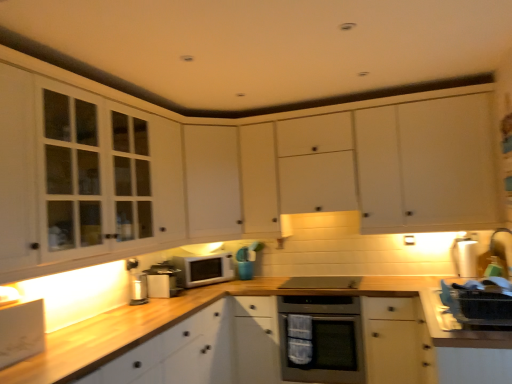
Question: From the image's perspective, would you say white wood cabinet at lower left, which appears as the 5th cabinetry when viewed from the top, is positioned over white glass-fronted cabinets at left, arranged as the 3th cabinetry when ordered from the bottom?

Choices:
 (A) no
 (B) yes

Answer: (A)

Question: Is white wood cabinet at lower left, positioned as the first cabinetry in bottom-to-top order, wider than white glass-fronted cabinets at left, arranged as the 3th cabinetry when ordered from the bottom?

Choices:
 (A) no
 (B) yes

Answer: (B)

Question: Is white glass-fronted cabinets at left, which is the third cabinetry from top to bottom, at the back of white wood cabinet at lower left, positioned as the first cabinetry in bottom-to-top order?

Choices:
 (A) no
 (B) yes

Answer: (A)

Question: Is white wood cabinet at lower left, positioned as the first cabinetry in bottom-to-top order, in contact with white glass-fronted cabinets at left, which is the third cabinetry from top to bottom?

Choices:
 (A) yes
 (B) no

Answer: (B)

Question: Is white wood cabinet at lower left, positioned as the first cabinetry in bottom-to-top order, further to camera compared to white glass-fronted cabinets at left, arranged as the 3th cabinetry when ordered from the bottom?

Choices:
 (A) yes
 (B) no

Answer: (B)

Question: Is point (181, 241) positioned closer to the camera than point (355, 352)?

Choices:
 (A) closer
 (B) farther

Answer: (B)

Question: Is white glass-fronted cabinets at left, arranged as the 3th cabinetry when ordered from the bottom, bigger or smaller than satin silver oven at center?

Choices:
 (A) small
 (B) big

Answer: (B)

Question: Choose the correct answer: Is white glass-fronted cabinets at left, arranged as the 3th cabinetry when ordered from the bottom, inside satin silver oven at center or outside it?

Choices:
 (A) outside
 (B) inside

Answer: (A)

Question: In the image, is white glass-fronted cabinets at left, arranged as the 3th cabinetry when ordered from the bottom, positioned in front of or behind satin silver oven at center?

Choices:
 (A) front
 (B) behind

Answer: (A)

Question: Is white matte microwave at center taller or shorter than white matte cabinet at center, arranged as the 2th cabinetry when ordered from the bottom?

Choices:
 (A) tall
 (B) short

Answer: (B)

Question: Relative to white matte cabinet at center, which ranks as the fourth cabinetry in top-to-bottom order, is white matte microwave at center in front or behind?

Choices:
 (A) front
 (B) behind

Answer: (B)

Question: Is white matte microwave at center wider or thinner than white matte cabinet at center, which ranks as the fourth cabinetry in top-to-bottom order?

Choices:
 (A) wide
 (B) thin

Answer: (B)

Question: Is point tap(224, 251) closer or farther from the camera than point tap(207, 142)?

Choices:
 (A) farther
 (B) closer

Answer: (A)

Question: Visually, is satin black stove at center, the 3th appliance from the left, positioned to the left or to the right of white matte cabinet at center, which ranks as the fourth cabinetry in bottom-to-top order?

Choices:
 (A) right
 (B) left

Answer: (A)

Question: In terms of size, does satin black stove at center, the 3th appliance from the left, appear bigger or smaller than white matte cabinet at center, marked as the second cabinetry in a top-to-bottom arrangement?

Choices:
 (A) big
 (B) small

Answer: (B)